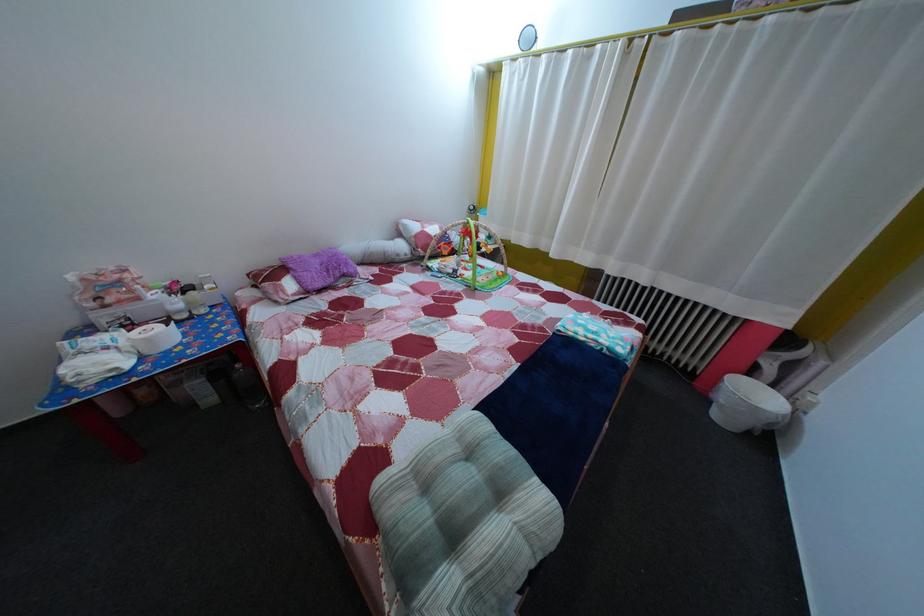
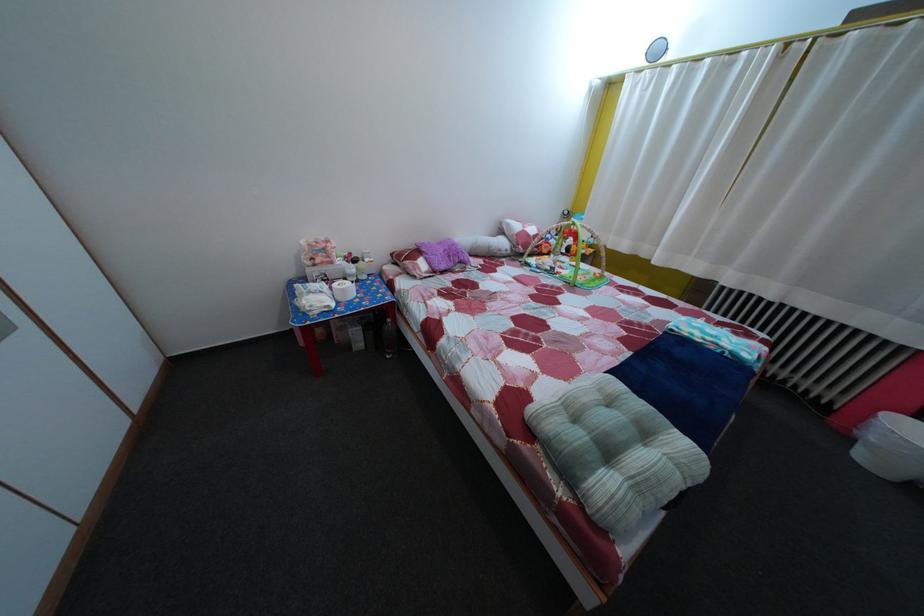
The point at (480,407) is marked in the first image. Where is the corresponding point in the second image?

(601, 379)